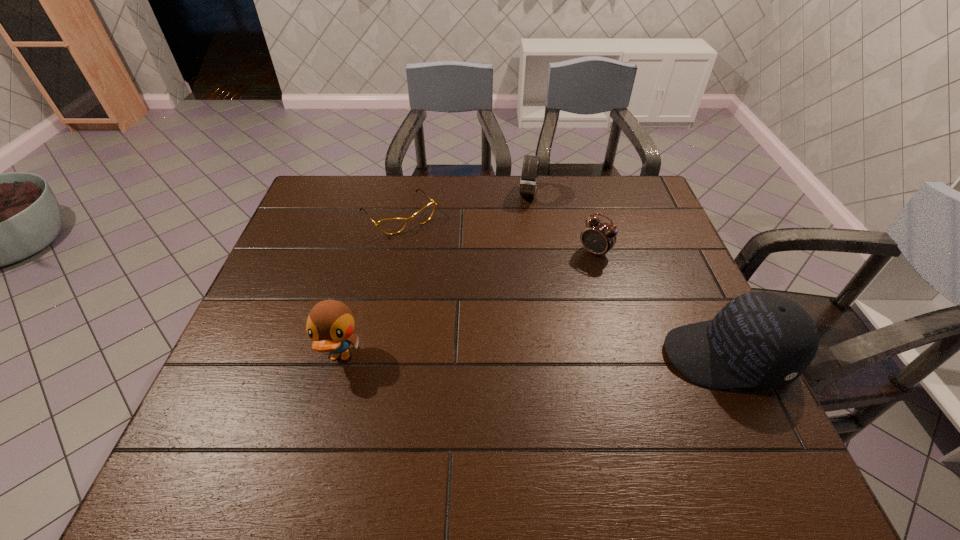
Image resolution: width=960 pixels, height=540 pixels. I want to click on object that is the fourth closest to the duck, so click(759, 339).

You are a GUI agent. You are given a task and a screenshot of the screen. Output one action in this format:
    pyautogui.click(x=<x>, y=<y>)
    Task: Click on the vacant space that satisfies the following two spatial constraints: 1. on the front side of the spectacles; 2. on the right side of the alarm clock
    This screenshot has width=960, height=540.
    Given the screenshot: What is the action you would take?
    pyautogui.click(x=391, y=252)

Locate an element on the screen. The width and height of the screenshot is (960, 540). free space that satisfies the following two spatial constraints: 1. on the front side of the alarm clock; 2. on the right side of the shortest object is located at coordinates (391, 252).

At what (x,y) coordinates should I click in order to perform the action: click on free point that satisfies the following two spatial constraints: 1. on the back side of the spectacles; 2. on the right side of the watch. Please return your answer as a coordinate pair (x, y). Looking at the image, I should click on (403, 193).

What are the coordinates of `vacant point that satisfies the following two spatial constraints: 1. on the front side of the rightmost object; 2. at the front of the third farthest object where the brim is located` in the screenshot? It's located at (623, 356).